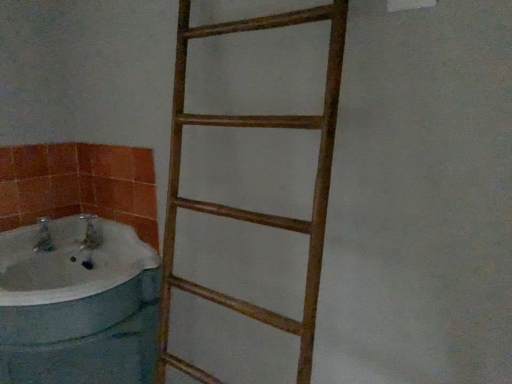
Question: Can you confirm if wooden ladder at center is positioned to the right of white glossy bathtub at left?

Choices:
 (A) yes
 (B) no

Answer: (A)

Question: Is wooden ladder at center smaller than white glossy bathtub at left?

Choices:
 (A) no
 (B) yes

Answer: (A)

Question: Is the depth of wooden ladder at center less than that of white glossy bathtub at left?

Choices:
 (A) yes
 (B) no

Answer: (A)

Question: Does wooden ladder at center appear on the left side of white glossy bathtub at left?

Choices:
 (A) no
 (B) yes

Answer: (A)

Question: Is wooden ladder at center thinner than white glossy bathtub at left?

Choices:
 (A) yes
 (B) no

Answer: (A)

Question: Is the position of wooden ladder at center more distant than that of white glossy bathtub at left?

Choices:
 (A) yes
 (B) no

Answer: (B)

Question: Is white glossy bathtub at left not within wooden ladder at center?

Choices:
 (A) yes
 (B) no

Answer: (A)

Question: Is white glossy bathtub at left thinner than wooden ladder at center?

Choices:
 (A) yes
 (B) no

Answer: (B)

Question: Would you say wooden ladder at center is part of white glossy bathtub at left's contents?

Choices:
 (A) no
 (B) yes

Answer: (A)

Question: From a real-world perspective, is white glossy bathtub at left on wooden ladder at center?

Choices:
 (A) no
 (B) yes

Answer: (A)

Question: Is white glossy bathtub at left at the right side of wooden ladder at center?

Choices:
 (A) no
 (B) yes

Answer: (A)

Question: Is white glossy bathtub at left closer to the viewer compared to wooden ladder at center?

Choices:
 (A) yes
 (B) no

Answer: (B)

Question: In the image, is wooden ladder at center positioned in front of or behind white glossy bathtub at left?

Choices:
 (A) front
 (B) behind

Answer: (A)